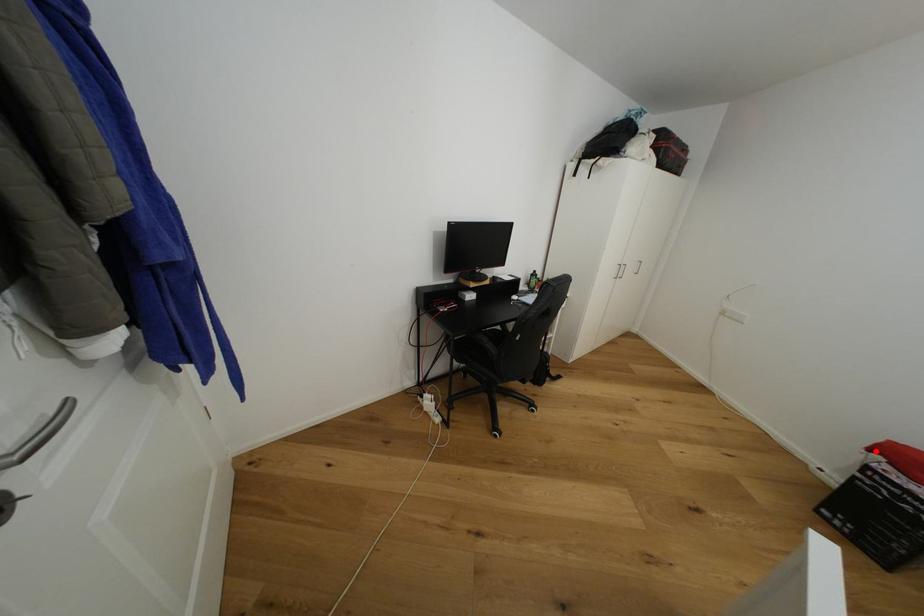
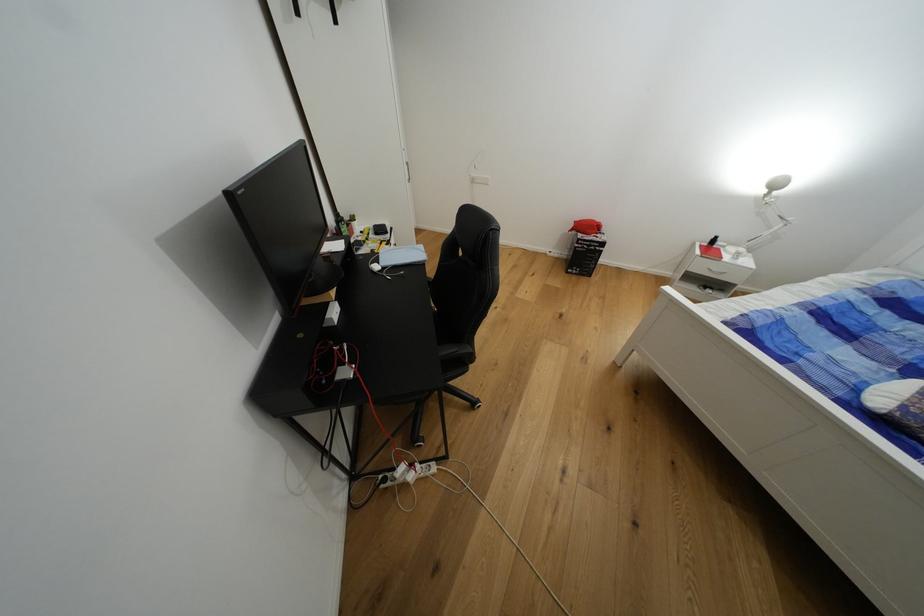
In the second image, find the point that corresponds to the highlighted location in the first image.

(576, 232)